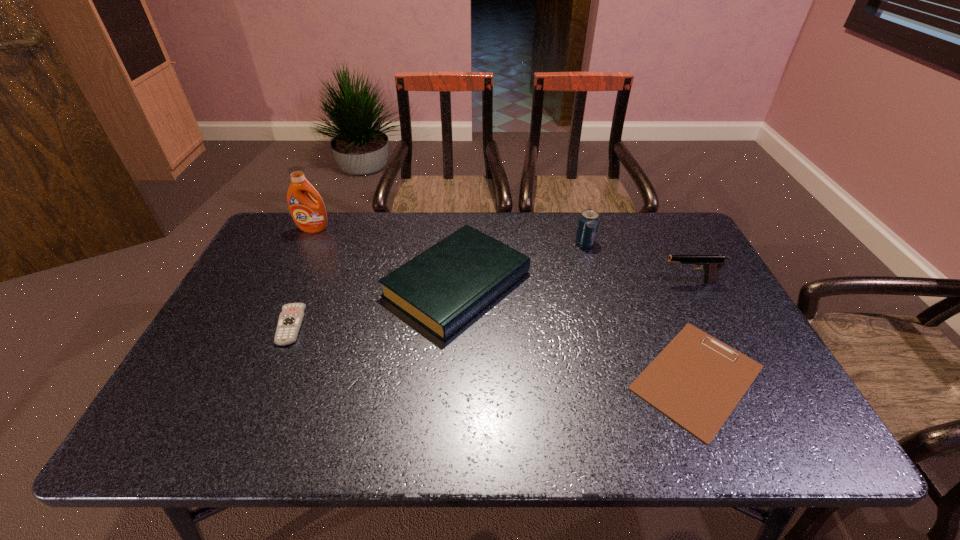
Locate an element on the screen. This screenshot has width=960, height=540. blank area in the image that satisfies the following two spatial constraints: 1. on the back side of the remote control; 2. on the left side of the third shortest object is located at coordinates (307, 284).

Where is `free space in the image that satisfies the following two spatial constraints: 1. on the front-facing side of the fifth tallest object; 2. on the left side of the farthest object`? The width and height of the screenshot is (960, 540). free space in the image that satisfies the following two spatial constraints: 1. on the front-facing side of the fifth tallest object; 2. on the left side of the farthest object is located at coordinates (267, 326).

Locate an element on the screen. This screenshot has height=540, width=960. vacant point that satisfies the following two spatial constraints: 1. on the back side of the pop soda; 2. on the right side of the book is located at coordinates (460, 242).

Where is `vacant space that satisfies the following two spatial constraints: 1. on the front-facing side of the fourth object from right to left; 2. on the left side of the farthest object`? This screenshot has height=540, width=960. vacant space that satisfies the following two spatial constraints: 1. on the front-facing side of the fourth object from right to left; 2. on the left side of the farthest object is located at coordinates (287, 284).

Find the location of a particular element. This screenshot has height=540, width=960. free space that satisfies the following two spatial constraints: 1. at the muzzle of the pistol; 2. on the front side of the clipboard is located at coordinates (739, 377).

Image resolution: width=960 pixels, height=540 pixels. Identify the location of free region that satisfies the following two spatial constraints: 1. on the front side of the shortest object; 2. on the right side of the pop soda. (624, 377).